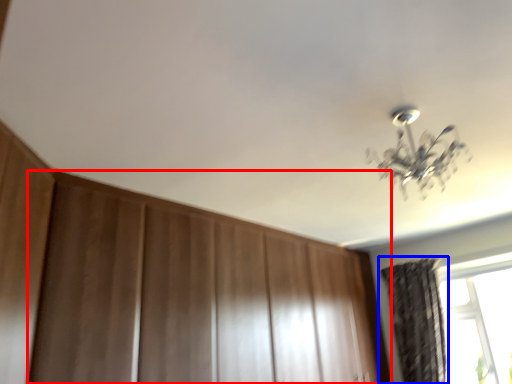
Question: Which object is further to the camera taking this photo, dresser (highlighted by a red box) or curtain (highlighted by a blue box)?

Choices:
 (A) dresser
 (B) curtain

Answer: (B)